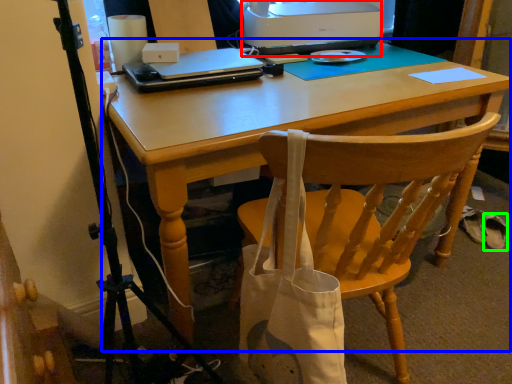
Question: Which object is positioned farthest from printer (highlighted by a red box)? Select from computer desk (highlighted by a blue box) and walking shoe (highlighted by a green box).

Choices:
 (A) computer desk
 (B) walking shoe

Answer: (B)